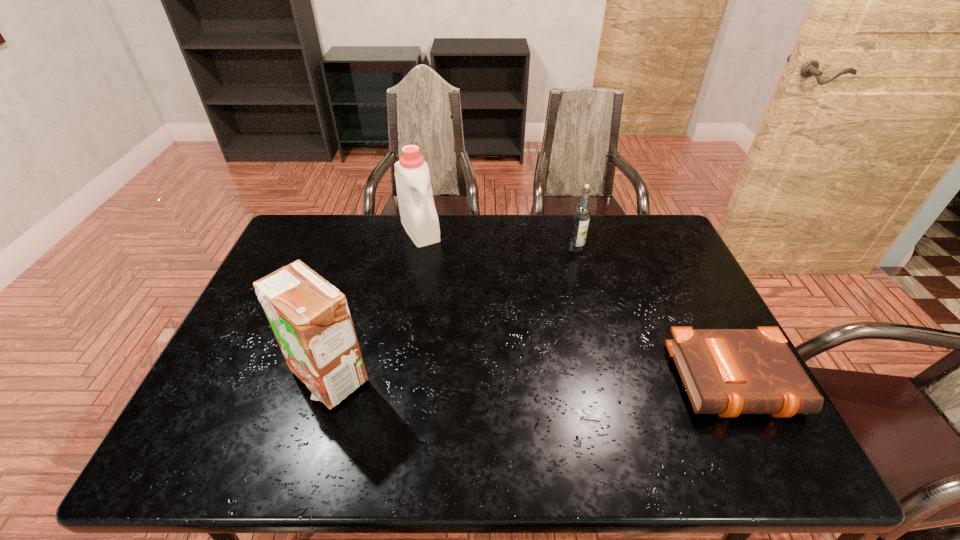
Image resolution: width=960 pixels, height=540 pixels. Identify the location of free space on the desktop that is between the carton and the rightmost object and is positioned on the handle side of the detergent. (512, 379).

Image resolution: width=960 pixels, height=540 pixels. I want to click on vacant space on the desktop that is between the carton and the shortest object and is positioned on the label of the third object from left to right, so click(594, 380).